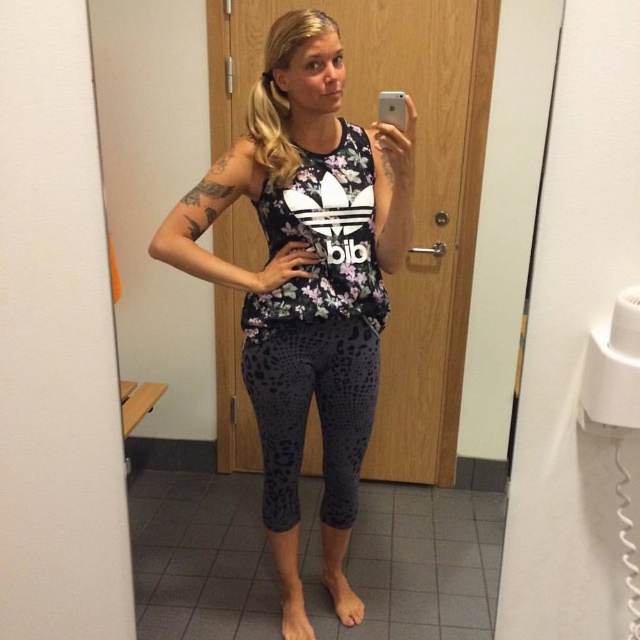
Which is above, floral fabric tank top at center or dark gray leopard print leggings at center?

Positioned higher is floral fabric tank top at center.

The width and height of the screenshot is (640, 640). What do you see at coordinates (307, 282) in the screenshot? I see `floral fabric tank top at center` at bounding box center [307, 282].

Does point (321, 26) lie behind point (282, 419)?

No.

Image resolution: width=640 pixels, height=640 pixels. Identify the location of floral fabric tank top at center. (307, 282).